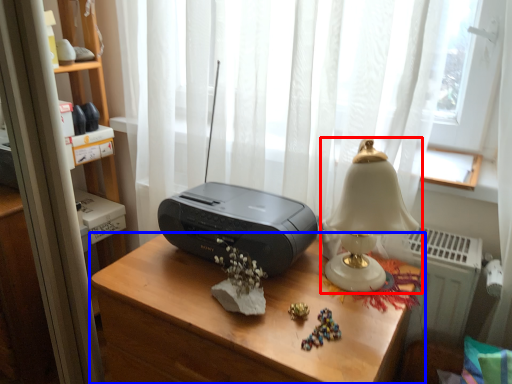
Question: Which object is closer to the camera taking this photo, lamp (highlighted by a red box) or desk (highlighted by a blue box)?

Choices:
 (A) lamp
 (B) desk

Answer: (B)